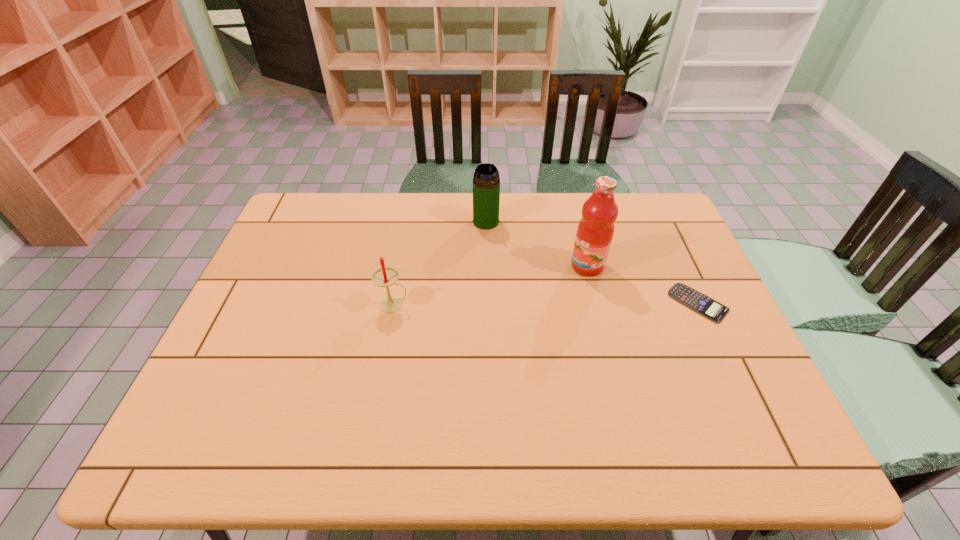
In order to click on free point located on the front label of the fruit juice in this screenshot , I will do `click(540, 301)`.

Where is `blank area located on the front label of the fruit juice`? This screenshot has width=960, height=540. blank area located on the front label of the fruit juice is located at coordinates (490, 338).

At what (x,y) coordinates should I click in order to perform the action: click on free space located on the front label of the fruit juice. Please return your answer as a coordinate pair (x, y). Looking at the image, I should click on (516, 318).

Where is `vacant space located 0.260m from the spout of the thermos bottle`? Image resolution: width=960 pixels, height=540 pixels. vacant space located 0.260m from the spout of the thermos bottle is located at coordinates (541, 276).

Identify the location of free region located 0.230m from the spout of the thermos bottle. (536, 271).

This screenshot has height=540, width=960. Identify the location of free location located from the spout of the thermos bottle. (546, 281).

The image size is (960, 540). In order to click on object that is at the far edge in this screenshot , I will do `click(486, 183)`.

Locate an element on the screen. Image resolution: width=960 pixels, height=540 pixels. object present at the right edge is located at coordinates (693, 299).

In the image, there is a desktop. Identify the location of vacant space at the far edge. (433, 233).

Find the location of a particular element. This screenshot has width=960, height=540. vacant region at the near edge of the desktop is located at coordinates (564, 410).